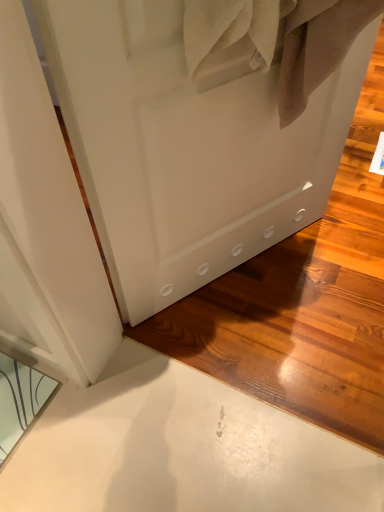
Describe the element at coordinates (20, 401) in the screenshot. I see `clear glass mirror at lower left` at that location.

Locate an element on the screen. The width and height of the screenshot is (384, 512). clear glass mirror at lower left is located at coordinates (20, 401).

Measure the distance between white matte door at center and camera.

The depth of white matte door at center is 61.29 centimeters.

This screenshot has height=512, width=384. Describe the element at coordinates (186, 146) in the screenshot. I see `white matte door at center` at that location.

In order to face white matte door at center, should I rotate leftwards or rightwards?

Turn right approximately 7.939 degrees to face it.

The image size is (384, 512). I want to click on white matte door at center, so click(x=186, y=146).

The height and width of the screenshot is (512, 384). Find the location of `clear glass mirror at lower left`. clear glass mirror at lower left is located at coordinates (20, 401).

Can you confirm if white matte door at center is positioned to the right of clear glass mirror at lower left?

Correct, you'll find white matte door at center to the right of clear glass mirror at lower left.

Is white matte door at center in front of or behind clear glass mirror at lower left in the image?

In the image, white matte door at center appears in front of clear glass mirror at lower left.

Is point (220, 172) positioned after point (42, 398)?

No, it is not.

From the image's perspective, is white matte door at center on top of clear glass mirror at lower left?

Yes, from the image's perspective, white matte door at center is on top of clear glass mirror at lower left.

From a real-world perspective, is white matte door at center positioned under clear glass mirror at lower left based on gravity?

No, from a real-world perspective, white matte door at center is not under clear glass mirror at lower left.

Considering the sizes of objects white matte door at center and clear glass mirror at lower left in the image provided, who is wider, white matte door at center or clear glass mirror at lower left?

clear glass mirror at lower left is wider.

Considering the relative sizes of white matte door at center and clear glass mirror at lower left in the image provided, is white matte door at center taller than clear glass mirror at lower left?

Yes.

Can you confirm if white matte door at center is smaller than clear glass mirror at lower left?

Actually, white matte door at center might be larger than clear glass mirror at lower left.

Is white matte door at center inside or outside of clear glass mirror at lower left?

white matte door at center is not inside clear glass mirror at lower left, it's outside.

Is white matte door at center far from clear glass mirror at lower left?

That's not correct — white matte door at center is a little close to clear glass mirror at lower left.

Is white matte door at center oriented towards clear glass mirror at lower left?

No, white matte door at center is not oriented towards clear glass mirror at lower left.

Can you tell me how much white matte door at center and clear glass mirror at lower left differ in facing direction?

The angle between the facing direction of white matte door at center and the facing direction of clear glass mirror at lower left is 33.5 degrees.

I want to click on door above the clear glass mirror at lower left (from the image's perspective), so click(x=186, y=146).

Which object is positioned more to the left, clear glass mirror at lower left or white matte door at center?

clear glass mirror at lower left is more to the left.

Is clear glass mirror at lower left positioned in front of white matte door at center?

No, clear glass mirror at lower left is further to the viewer.

Is point (20, 400) positioned before point (254, 182)?

Yes, it is in front of point (254, 182).

From the picture: From the image's perspective, would you say clear glass mirror at lower left is shown under white matte door at center?

Yes.

From a real-world perspective, is clear glass mirror at lower left positioned under white matte door at center based on gravity?

Correct, in the physical world, clear glass mirror at lower left is lower than white matte door at center.

Considering the relative sizes of clear glass mirror at lower left and white matte door at center in the image provided, is clear glass mirror at lower left thinner than white matte door at center?

Incorrect, the width of clear glass mirror at lower left is not less than that of white matte door at center.

Does clear glass mirror at lower left have a greater height compared to white matte door at center?

Incorrect, the height of clear glass mirror at lower left is not larger of that of white matte door at center.

Considering the sizes of clear glass mirror at lower left and white matte door at center in the image, is clear glass mirror at lower left bigger or smaller than white matte door at center?

clear glass mirror at lower left is smaller than white matte door at center.

Do you think clear glass mirror at lower left is within white matte door at center, or outside of it?

clear glass mirror at lower left is located beyond the bounds of white matte door at center.

Are clear glass mirror at lower left and white matte door at center located far from each other?

Actually, clear glass mirror at lower left and white matte door at center are a little close together.

Is clear glass mirror at lower left oriented towards white matte door at center?

No, clear glass mirror at lower left is not turned towards white matte door at center.

Can you tell me how much clear glass mirror at lower left and white matte door at center differ in facing direction?

There is a 33.5-degree angle between the facing directions of clear glass mirror at lower left and white matte door at center.

Where is `door that is above the clear glass mirror at lower left (from a real-world perspective)`? door that is above the clear glass mirror at lower left (from a real-world perspective) is located at coordinates (186, 146).

Locate an element on the screen. door above the clear glass mirror at lower left (from a real-world perspective) is located at coordinates (186, 146).

In order to click on mirror on the left of the white matte door at center in this screenshot , I will do `click(20, 401)`.